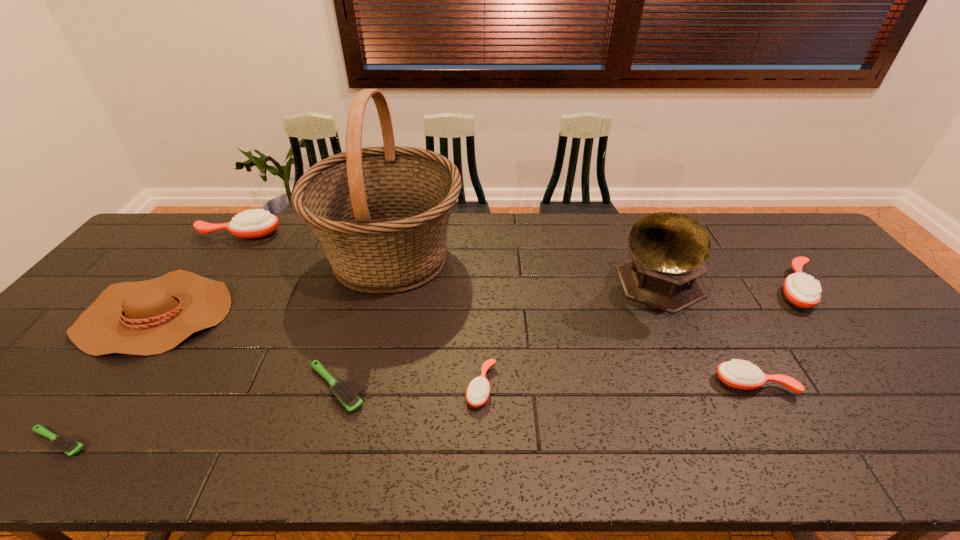
Locate an element on the screen. This screenshot has width=960, height=540. empty space that is in between the second tallest object and the rightmost object is located at coordinates (726, 287).

You are a GUI agent. You are given a task and a screenshot of the screen. Output one action in this format:
    pyautogui.click(x=<x>, y=<y>)
    Task: Click on the vacant point located between the rightmost orange hairbrush and the fourth shortest hairbrush
    
    Given the screenshot: What is the action you would take?
    pyautogui.click(x=775, y=336)

This screenshot has width=960, height=540. I want to click on free space between the phonograph record and the fourth shortest hairbrush, so click(x=704, y=335).

Find the location of a particular element. free space between the second farthest orange hairbrush and the farthest orange hairbrush is located at coordinates (518, 261).

Locate an element on the screen. Image resolution: width=960 pixels, height=540 pixels. empty space between the rightmost object and the leftmost orange hairbrush is located at coordinates (518, 261).

I want to click on vacant space that's between the right light hairbrush and the nearer light hairbrush, so click(x=198, y=415).

Choose which object is the eighth nearest neighbor to the second orange hairbrush from right to left. Please provide its 2D coordinates. Your answer should be formatted as a tuple, i.e. [(x, y)], where the tuple contains the x and y coordinates of a point satisfying the conditions above.

[(65, 443)]

Choose which object is the nearest neighbor to the phonograph record. Please provide its 2D coordinates. Your answer should be formatted as a tuple, i.e. [(x, y)], where the tuple contains the x and y coordinates of a point satisfying the conditions above.

[(739, 374)]

Locate an element on the screen. hairbrush object that ranks as the closest to the third orange hairbrush from right to left is located at coordinates (347, 396).

Locate an element on the screen. hairbrush that is the fourth closest one to the cowboy hat is located at coordinates click(478, 391).